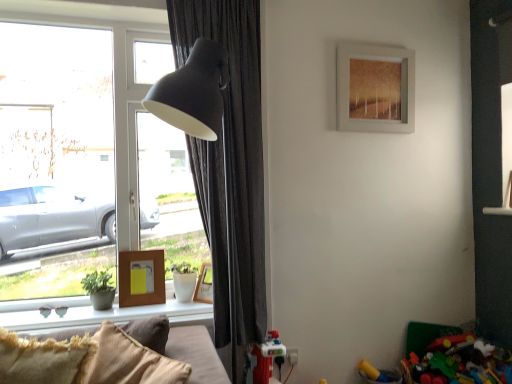
Question: Can woodenobject at lower left, which is the first picture frame from left to right, be found inside transparent glass window at left?

Choices:
 (A) yes
 (B) no

Answer: (B)

Question: From a real-world perspective, is transparent glass window at left beneath woodenobject at lower left, arranged as the 2th picture frame when viewed from the top?

Choices:
 (A) no
 (B) yes

Answer: (A)

Question: Considering the relative sizes of transparent glass window at left and woodenobject at lower left, which is the first picture frame from left to right, in the image provided, is transparent glass window at left smaller than woodenobject at lower left, which is the first picture frame from left to right,?

Choices:
 (A) yes
 (B) no

Answer: (B)

Question: Is the position of transparent glass window at left more distant than that of woodenobject at lower left, arranged as the 2th picture frame when viewed from the top?

Choices:
 (A) no
 (B) yes

Answer: (A)

Question: Is transparent glass window at left far from woodenobject at lower left, which is the second picture frame in bottom-to-top order?

Choices:
 (A) no
 (B) yes

Answer: (A)

Question: From a real-world perspective, is transparent glass window at left positioned over woodenobject at lower left, the 3th picture frame positioned from the right, based on gravity?

Choices:
 (A) no
 (B) yes

Answer: (B)

Question: Can you confirm if woodenobject at lower left, which is the first picture frame from left to right, is bigger than smooth concrete window sill at lower left?

Choices:
 (A) yes
 (B) no

Answer: (B)

Question: Are woodenobject at lower left, which is the second picture frame in bottom-to-top order, and smooth concrete window sill at lower left making contact?

Choices:
 (A) no
 (B) yes

Answer: (A)

Question: From a real-world perspective, is woodenobject at lower left, which is the first picture frame from left to right, positioned over smooth concrete window sill at lower left based on gravity?

Choices:
 (A) no
 (B) yes

Answer: (B)

Question: Is woodenobject at lower left, arranged as the 2th picture frame when viewed from the top, facing away from smooth concrete window sill at lower left?

Choices:
 (A) no
 (B) yes

Answer: (A)

Question: Does woodenobject at lower left, arranged as the 2th picture frame when viewed from the top, appear on the left side of smooth concrete window sill at lower left?

Choices:
 (A) yes
 (B) no

Answer: (B)

Question: Could smooth concrete window sill at lower left be considered to be inside woodenobject at lower left, which is the second picture frame in bottom-to-top order?

Choices:
 (A) no
 (B) yes

Answer: (A)

Question: Considering the relative sizes of woodenobject at lower left, which is the second picture frame in bottom-to-top order, and matte brown picture frame at upper center, the 3th picture frame ordered from the bottom, in the image provided, is woodenobject at lower left, which is the second picture frame in bottom-to-top order, smaller than matte brown picture frame at upper center, the 3th picture frame ordered from the bottom,?

Choices:
 (A) yes
 (B) no

Answer: (A)